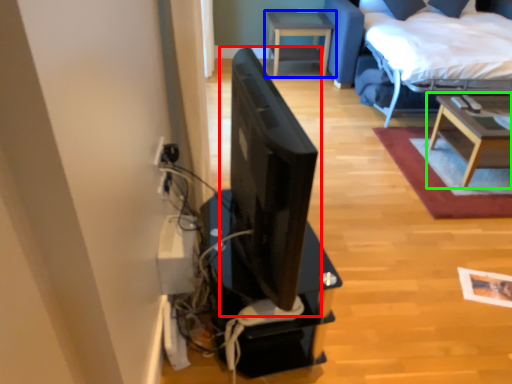
Question: Considering the real-world distances, which object is closest to computer monitor (highlighted by a red box)? table (highlighted by a blue box) or table (highlighted by a green box).

Choices:
 (A) table
 (B) table

Answer: (B)